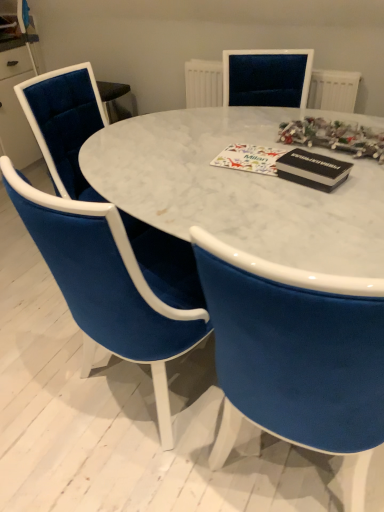
Question: Considering the positions of point (46, 148) and point (322, 103), is point (46, 148) closer or farther from the camera than point (322, 103)?

Choices:
 (A) closer
 (B) farther

Answer: (A)

Question: Considering the positions of velvet blue chair at lower left, marked as the second chair in a front-to-back arrangement, and white textured radiator at upper center in the image, is velvet blue chair at lower left, marked as the second chair in a front-to-back arrangement, taller or shorter than white textured radiator at upper center?

Choices:
 (A) tall
 (B) short

Answer: (A)

Question: Estimate the real-world distances between objects in this image. Which object is closer to the black matte magazine at upper right?

Choices:
 (A) velvet blue chair at center, placed as the second chair when sorted from back to front
 (B) velvet blue chair at lower left, marked as the second chair in a front-to-back arrangement
 (C) white matte christmas card at center
 (D) white textured radiator at upper center
 (E) white marble table at center

Answer: (C)

Question: Which of these objects is positioned closest to the white textured radiator at upper center?

Choices:
 (A) white matte christmas card at center
 (B) black matte magazine at upper right
 (C) velvet blue chair at center, which ranks as the 1th chair in front-to-back order
 (D) white marble table at center
 (E) velvet blue chair at lower left, positioned as the 1th chair in back-to-front order

Answer: (A)